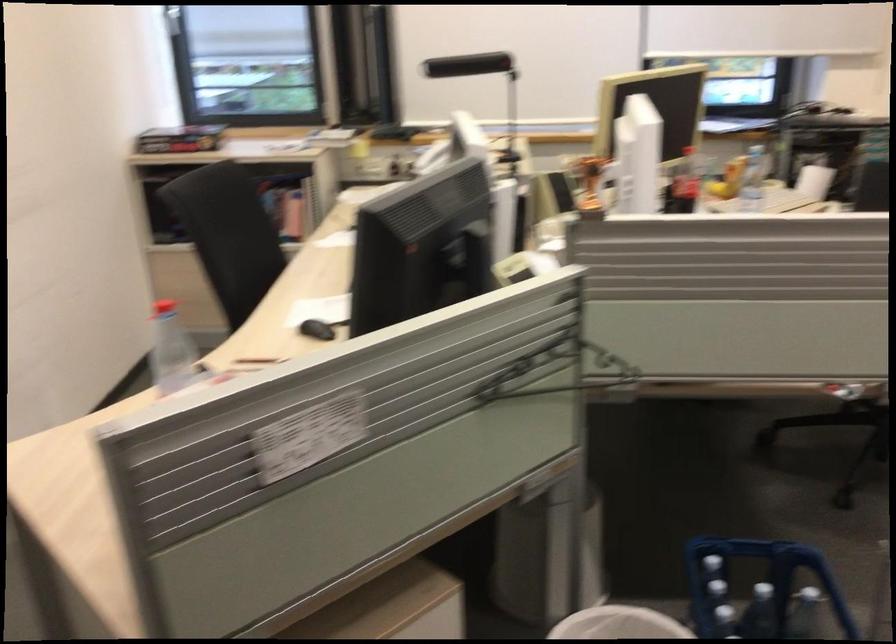
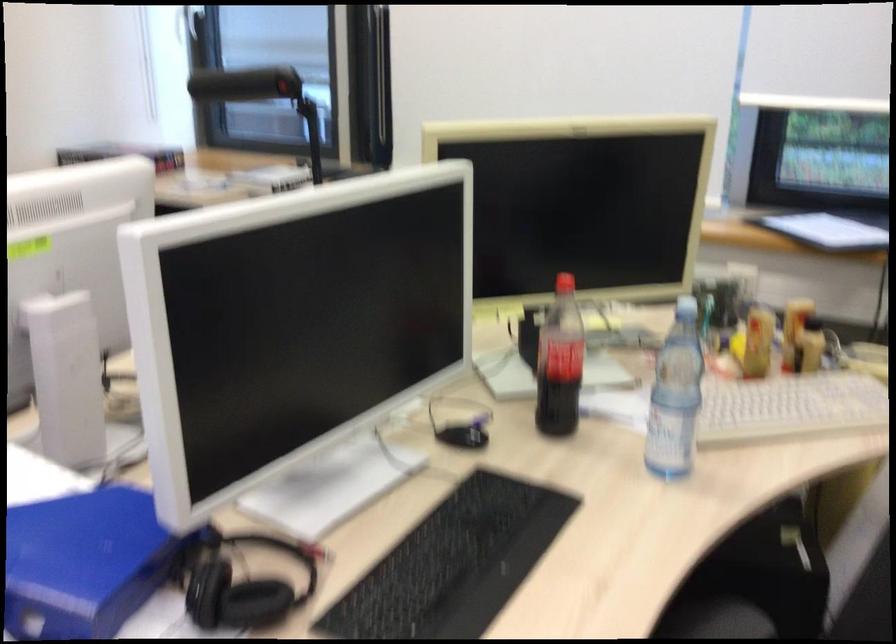
Which direction would the cameraman need to move to produce the second image?

The cameraman moved toward right, forward.